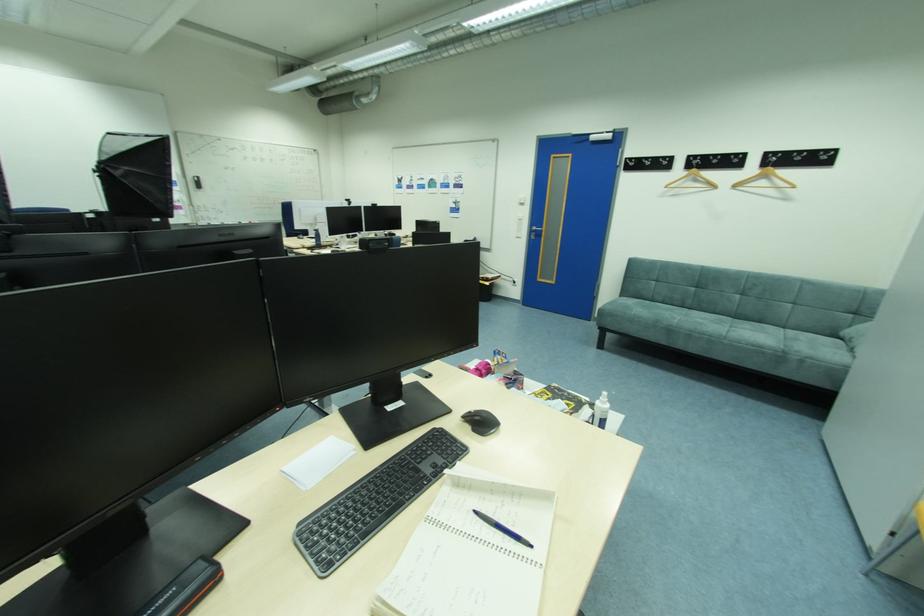
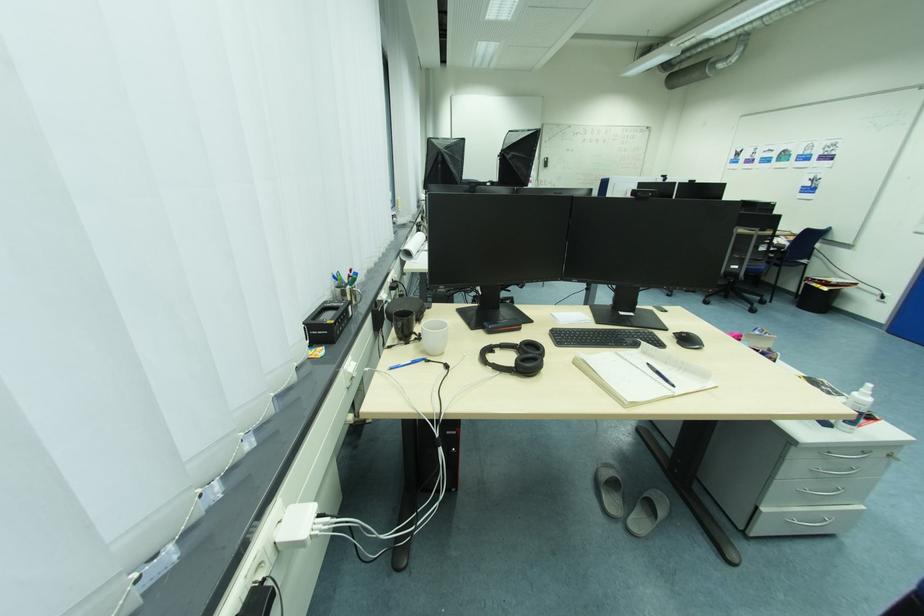
The point at (494, 285) is marked in the first image. Where is the corresponding point in the second image?

(833, 290)